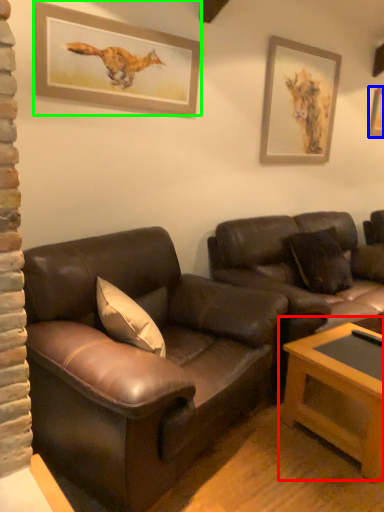
Question: Estimate the real-world distances between objects in this image. Which object is closer to table (highlighted by a red box), picture frame (highlighted by a blue box) or picture frame (highlighted by a green box)?

Choices:
 (A) picture frame
 (B) picture frame

Answer: (B)